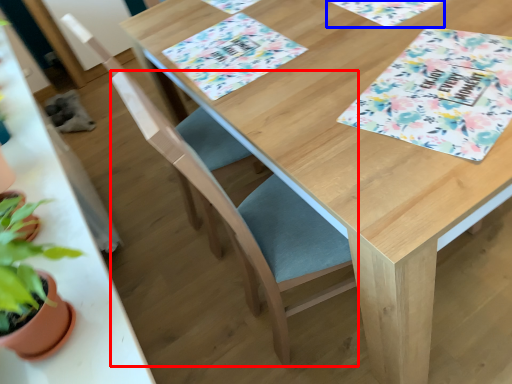
Question: Among these objects, which one is farthest to the camera, folding chair (highlighted by a red box) or place mat (highlighted by a blue box)?

Choices:
 (A) folding chair
 (B) place mat

Answer: (B)